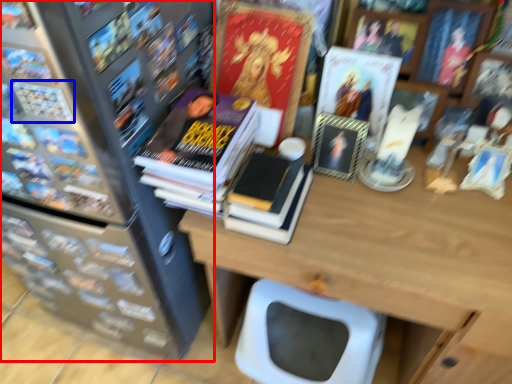
Question: Which of the following is the closest to the observer, bookcase (highlighted by a red box) or book (highlighted by a blue box)?

Choices:
 (A) bookcase
 (B) book

Answer: (A)